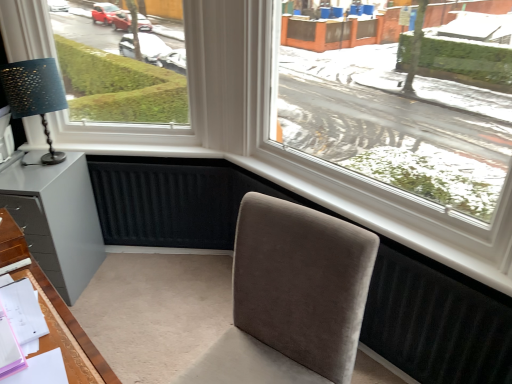
Question: Relative to matte black lampshade at left, is white plastic window at upper left in front or behind?

Choices:
 (A) behind
 (B) front

Answer: (A)

Question: In the image, is white plastic window at upper left on the left side or the right side of matte black lampshade at left?

Choices:
 (A) left
 (B) right

Answer: (B)

Question: Which object is positioned closest to the transparent glass window at center?

Choices:
 (A) matte gray cabinet at lower left
 (B) matte black lampshade at left
 (C) white plastic window at upper left
 (D) suede-like beige chair at center

Answer: (C)

Question: Considering the real-world distances, which object is closest to the matte black lampshade at left?

Choices:
 (A) white plastic window at upper left
 (B) matte gray cabinet at lower left
 (C) transparent glass window at center
 (D) suede-like beige chair at center

Answer: (A)